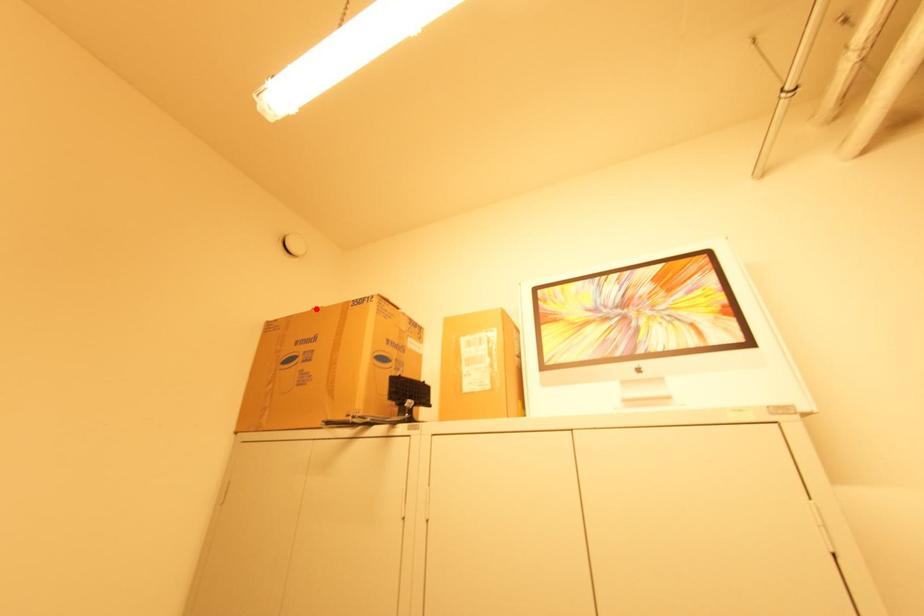
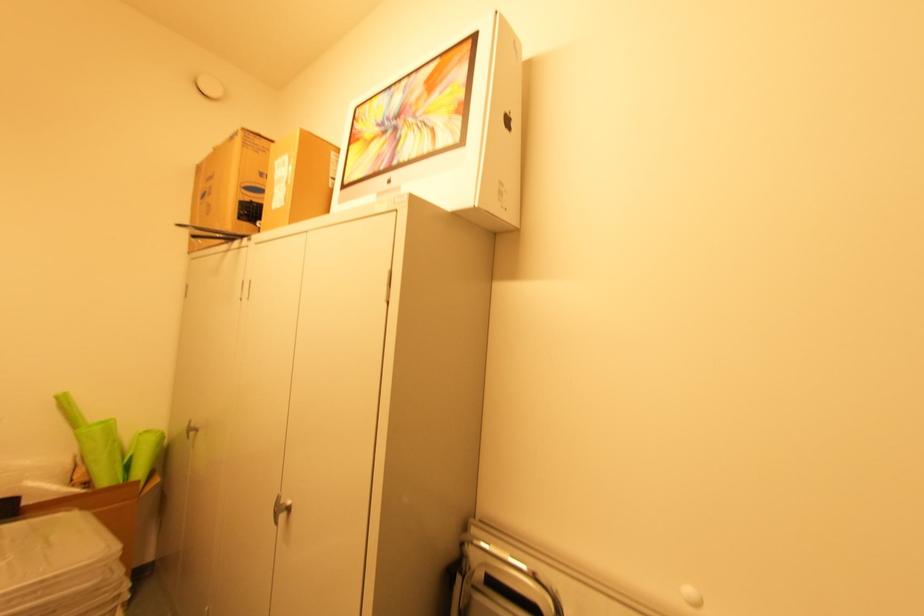
Locate, in the second image, the point that corresponds to the highlighted location in the first image.

(216, 148)